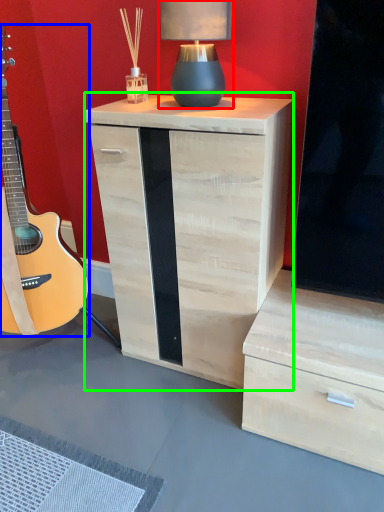
Question: Based on their relative distances, which object is farther from table lamp (highlighted by a red box)? Choose from guitar (highlighted by a blue box) and nightstand (highlighted by a green box).

Choices:
 (A) guitar
 (B) nightstand

Answer: (A)